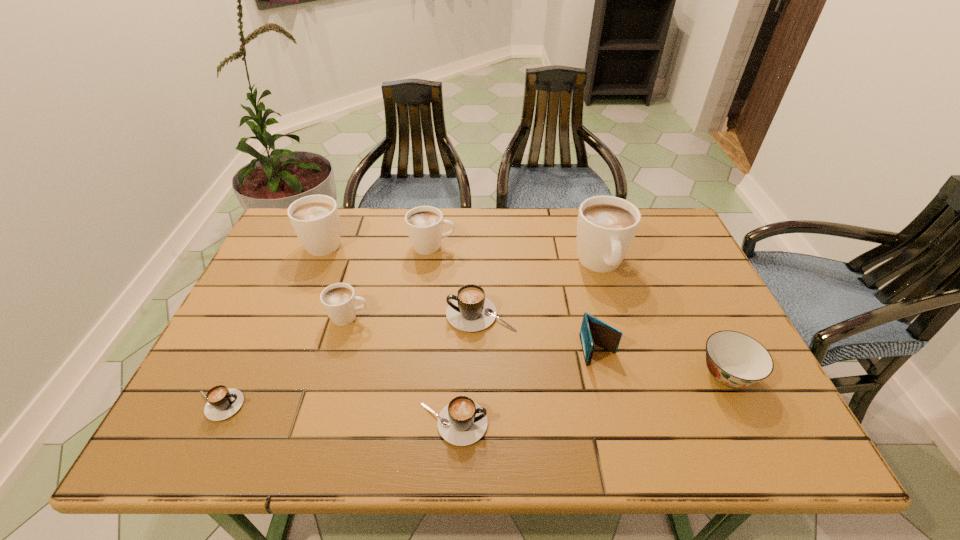
This screenshot has height=540, width=960. What are the coordinates of `the rightmost object` in the screenshot? It's located at (735, 359).

This screenshot has height=540, width=960. In order to click on the second shortest cappuccino in this screenshot , I will do `click(462, 422)`.

You are a GUI agent. You are given a task and a screenshot of the screen. Output one action in this format:
    pyautogui.click(x=<x>, y=<y>)
    Task: Click on the second smallest black cappuccino
    The image size is (960, 540).
    Given the screenshot: What is the action you would take?
    pyautogui.click(x=462, y=422)

Identify the location of the smallest black cappuccino. (222, 403).

At what (x,y) coordinates should I click in order to perform the action: click on the shortest cappuccino. Please return your answer as a coordinate pair (x, y). The height and width of the screenshot is (540, 960). Looking at the image, I should click on (222, 403).

Locate an element on the screen. The height and width of the screenshot is (540, 960). free location located 0.130m with the handle on the side of the tallest cappuccino is located at coordinates (619, 326).

This screenshot has height=540, width=960. Find the location of `free region located with the handle on the side of the third smallest white cappuccino`. free region located with the handle on the side of the third smallest white cappuccino is located at coordinates (337, 212).

Locate an element on the screen. vacant region located with the handle on the side of the third white cappuccino from left to right is located at coordinates (512, 246).

This screenshot has width=960, height=540. What are the coordinates of `free space located 0.150m with the handle on the side of the smallest white cappuccino` in the screenshot? It's located at (428, 317).

Where is `vacant position located 0.200m on the exterior surface of the blue wallet`? vacant position located 0.200m on the exterior surface of the blue wallet is located at coordinates (623, 450).